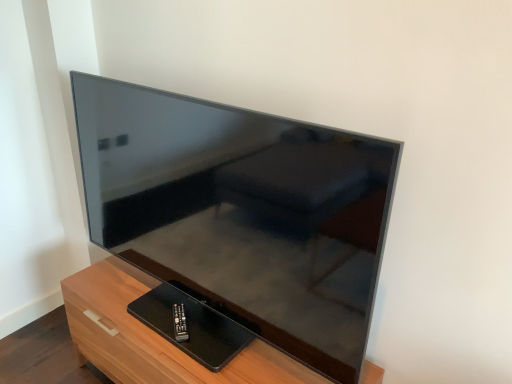
Question: Is black plastic remote at lower center further to the viewer compared to matte black tv at center?

Choices:
 (A) no
 (B) yes

Answer: (B)

Question: Is black plastic remote at lower center taller than matte black tv at center?

Choices:
 (A) no
 (B) yes

Answer: (A)

Question: Does black plastic remote at lower center turn towards matte black tv at center?

Choices:
 (A) yes
 (B) no

Answer: (A)

Question: Considering the relative sizes of black plastic remote at lower center and matte black tv at center in the image provided, is black plastic remote at lower center wider than matte black tv at center?

Choices:
 (A) no
 (B) yes

Answer: (A)

Question: Does black plastic remote at lower center have a lesser width compared to matte black tv at center?

Choices:
 (A) yes
 (B) no

Answer: (A)

Question: From the image's perspective, is black plastic remote at lower center over matte black tv at center?

Choices:
 (A) no
 (B) yes

Answer: (A)

Question: Does matte black tv at center have a lesser height compared to wooden tv stand at lower left?

Choices:
 (A) yes
 (B) no

Answer: (B)

Question: Can you confirm if matte black tv at center is wider than wooden tv stand at lower left?

Choices:
 (A) yes
 (B) no

Answer: (B)

Question: Does matte black tv at center turn towards wooden tv stand at lower left?

Choices:
 (A) no
 (B) yes

Answer: (A)

Question: Is matte black tv at center at the left side of wooden tv stand at lower left?

Choices:
 (A) yes
 (B) no

Answer: (B)

Question: Does matte black tv at center lie in front of wooden tv stand at lower left?

Choices:
 (A) no
 (B) yes

Answer: (B)

Question: From the image's perspective, does matte black tv at center appear lower than wooden tv stand at lower left?

Choices:
 (A) yes
 (B) no

Answer: (B)

Question: Does wooden tv stand at lower left come in front of black plastic remote at lower center?

Choices:
 (A) no
 (B) yes

Answer: (B)